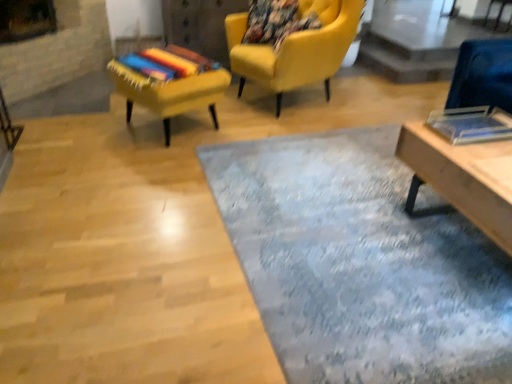
This screenshot has height=384, width=512. What are the coordinates of `vacant space to the left of textured blue rug at center` in the screenshot? It's located at (124, 216).